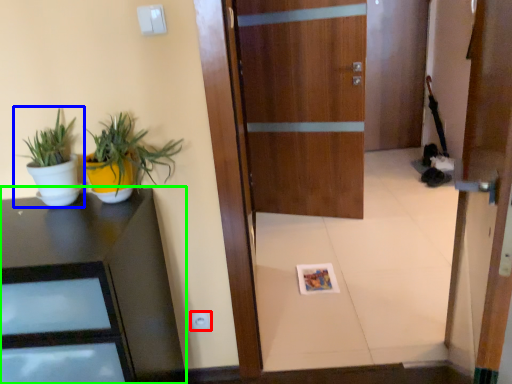
Question: Which is nearer to the electric outlet (highlighted by a red box)? houseplant (highlighted by a blue box) or desk (highlighted by a green box).

Choices:
 (A) houseplant
 (B) desk

Answer: (B)